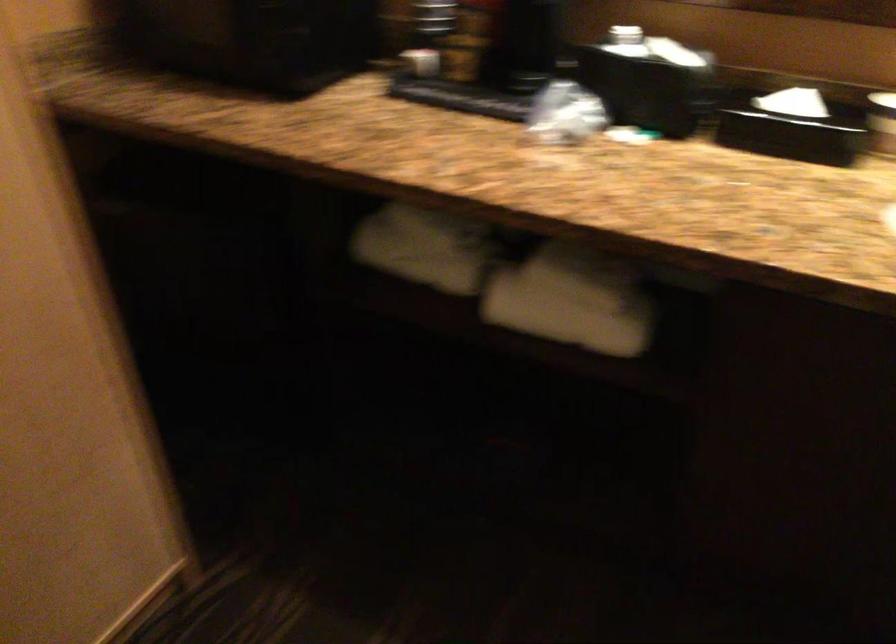
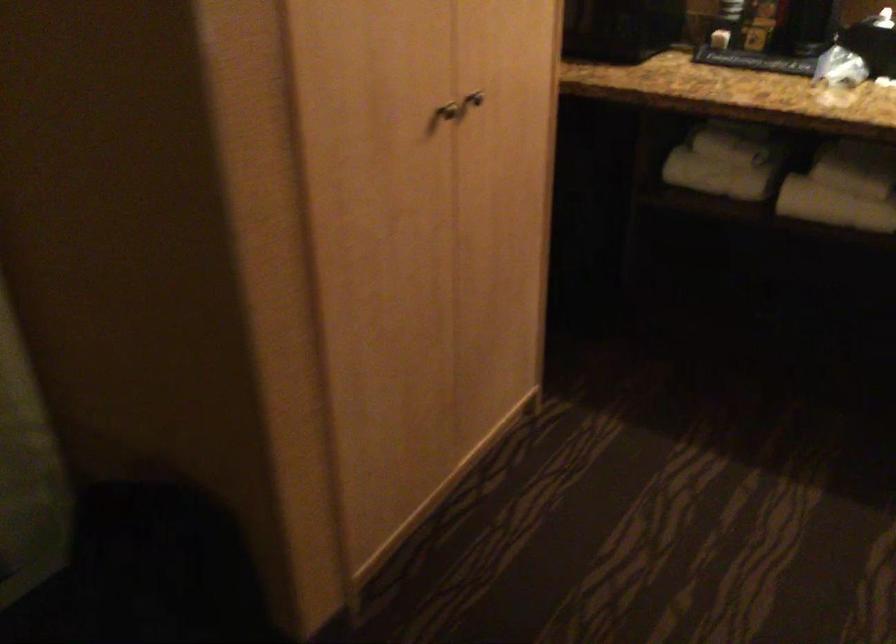
Question: The camera is either moving clockwise (left) or counter-clockwise (right) around the object. The first image is from the beginning of the video and the second image is from the end. Is the camera moving left or right when shooting the video?

Choices:
 (A) Left
 (B) Right

Answer: (B)